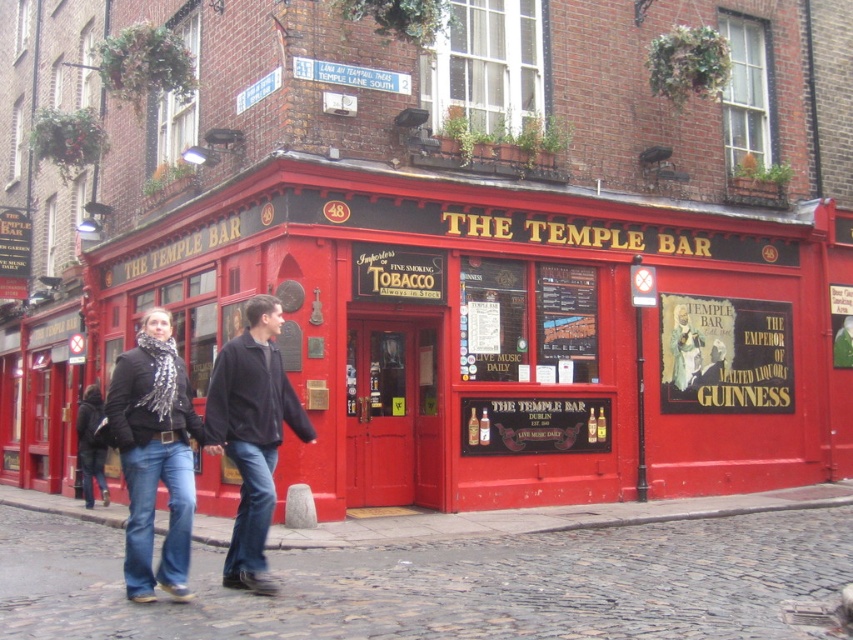
Does denim jeans at lower left have a lesser width compared to black matte jacket at lower left?

In fact, denim jeans at lower left might be wider than black matte jacket at lower left.

Is point (160, 397) closer to camera compared to point (155, 380)?

Yes, it is in front of point (155, 380).

Where is `denim jeans at lower left`? The height and width of the screenshot is (640, 853). denim jeans at lower left is located at coordinates (154, 454).

Can you confirm if cobblestone at lower center is shorter than black suede jacket at center?

Yes, cobblestone at lower center is shorter than black suede jacket at center.

At what (x,y) coordinates should I click in order to perform the action: click on cobblestone at lower center. Please return your answer as a coordinate pair (x, y). The width and height of the screenshot is (853, 640). Looking at the image, I should click on [448, 582].

Which is more to the left, denim jeans at lower left or jeans at lower left?

Positioned to the left is jeans at lower left.

Can you confirm if denim jeans at lower left is positioned to the right of jeans at lower left?

Correct, you'll find denim jeans at lower left to the right of jeans at lower left.

Who is more forward, (178, 444) or (102, 467)?

Point (178, 444)

Locate an element on the screen. This screenshot has width=853, height=640. denim jeans at lower left is located at coordinates (154, 454).